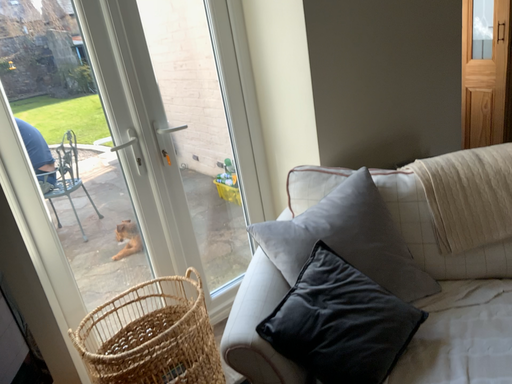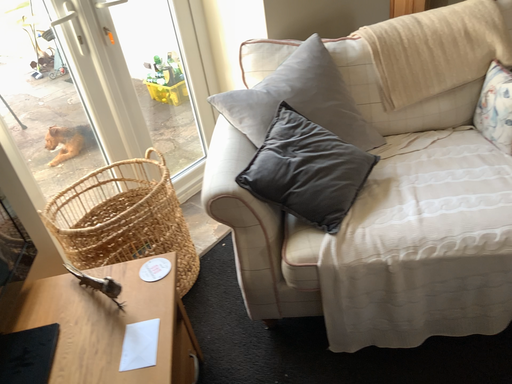
Question: How did the camera likely rotate when shooting the video?

Choices:
 (A) rotated downward
 (B) rotated upward

Answer: (A)